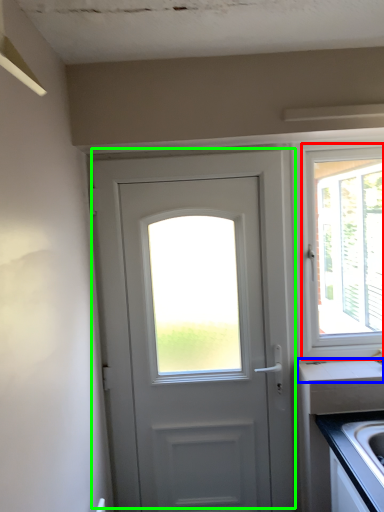
Question: Estimate the real-world distances between objects in this image. Which object is closer to window (highlighted by a red box), counter top (highlighted by a blue box) or door (highlighted by a green box)?

Choices:
 (A) counter top
 (B) door

Answer: (A)